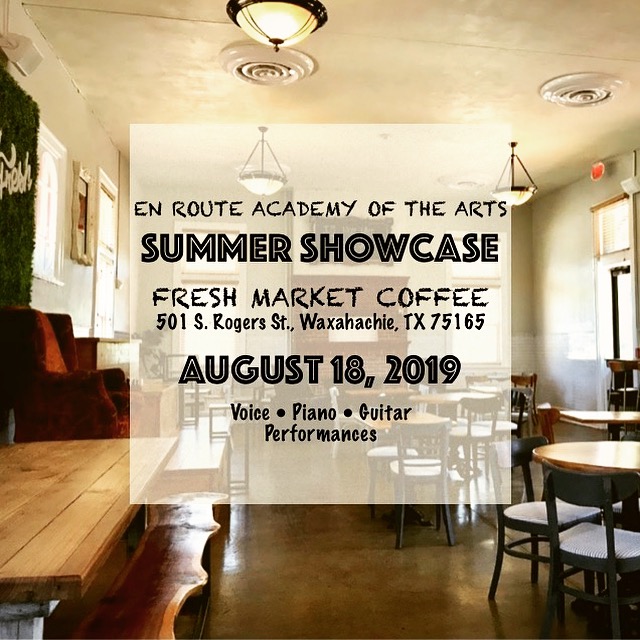
Image resolution: width=640 pixels, height=640 pixels. In order to click on black chair in this screenshot , I will do `click(532, 534)`, `click(580, 561)`, `click(402, 520)`, `click(522, 410)`.